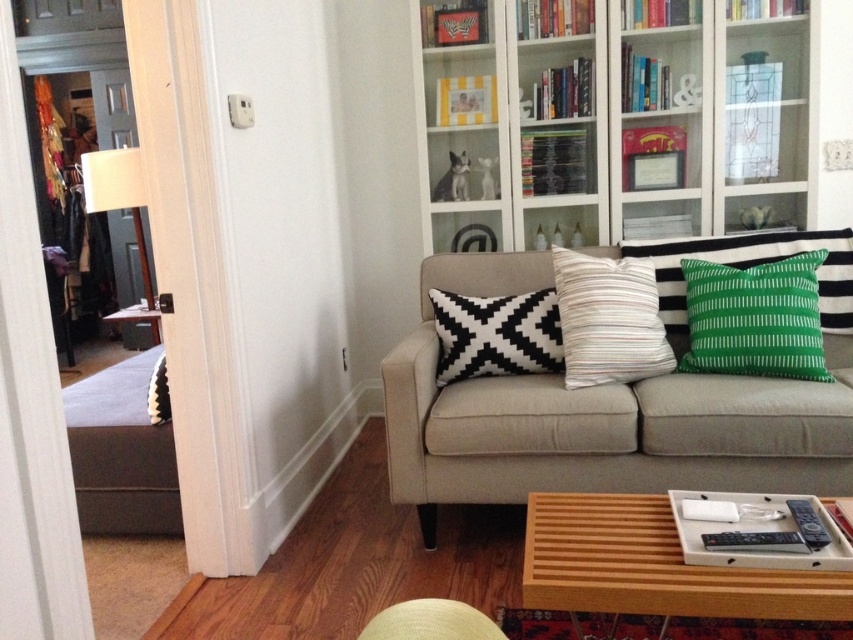
Which is behind, point (419, 422) or point (621, 344)?

The point (621, 344) is more distant.

Image resolution: width=853 pixels, height=640 pixels. Describe the element at coordinates (618, 400) in the screenshot. I see `beige fabric couch at center` at that location.

This screenshot has height=640, width=853. I want to click on beige fabric couch at center, so click(618, 400).

Can you confirm if white glass bookcase at upper center is positioned to the left of white fabric lamp at left?

In fact, white glass bookcase at upper center is to the right of white fabric lamp at left.

Is white glass bookcase at upper center closer to the viewer compared to white fabric lamp at left?

That is True.

Who is more distant from viewer, [550,186] or [131,179]?

Point [131,179]

Where is `white glass bookcase at upper center`? white glass bookcase at upper center is located at coordinates (613, 116).

From the picture: Is black and white woven pillow at center positioned behind white fabric lamp at left?

No, it is not.

Does black and white woven pillow at center appear on the right side of white fabric lamp at left?

Indeed, black and white woven pillow at center is positioned on the right side of white fabric lamp at left.

Which is behind, point (462, 326) or point (132, 166)?

The point (132, 166) is more distant.

At what (x,y) coordinates should I click in order to perform the action: click on black and white woven pillow at center. Please return your answer as a coordinate pair (x, y). Image resolution: width=853 pixels, height=640 pixels. Looking at the image, I should click on (496, 333).